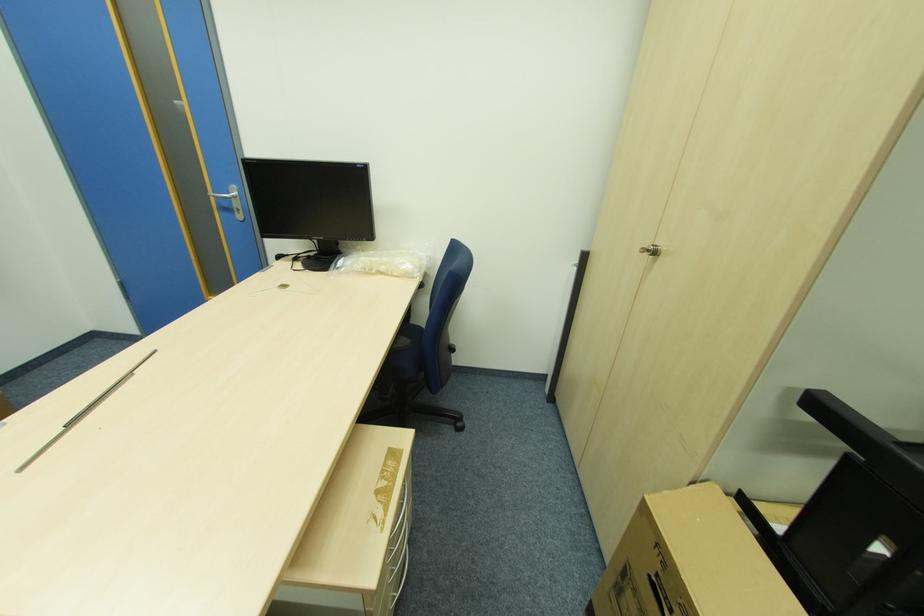
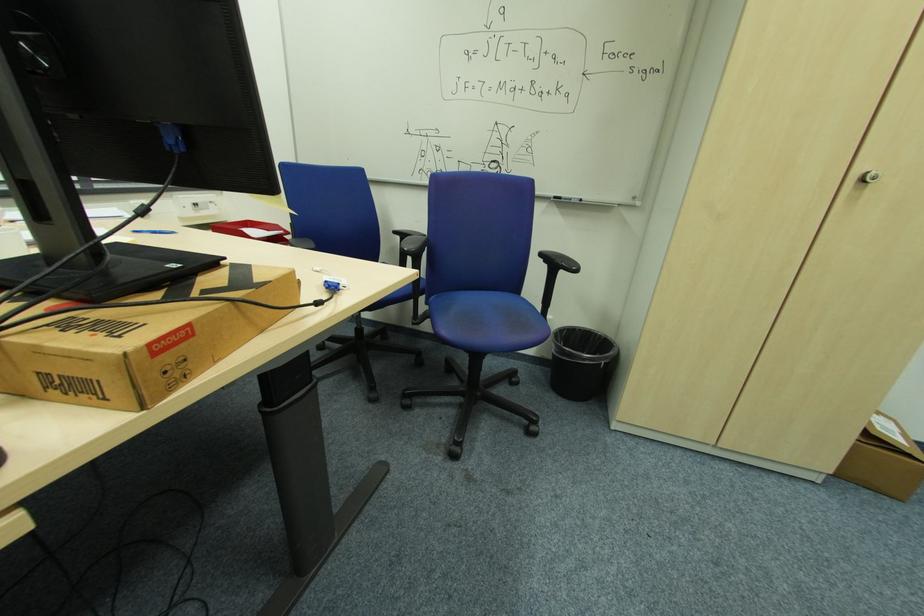
Based on the continuous images, in which direction is the camera rotating?

The camera's rotation is toward left-down.